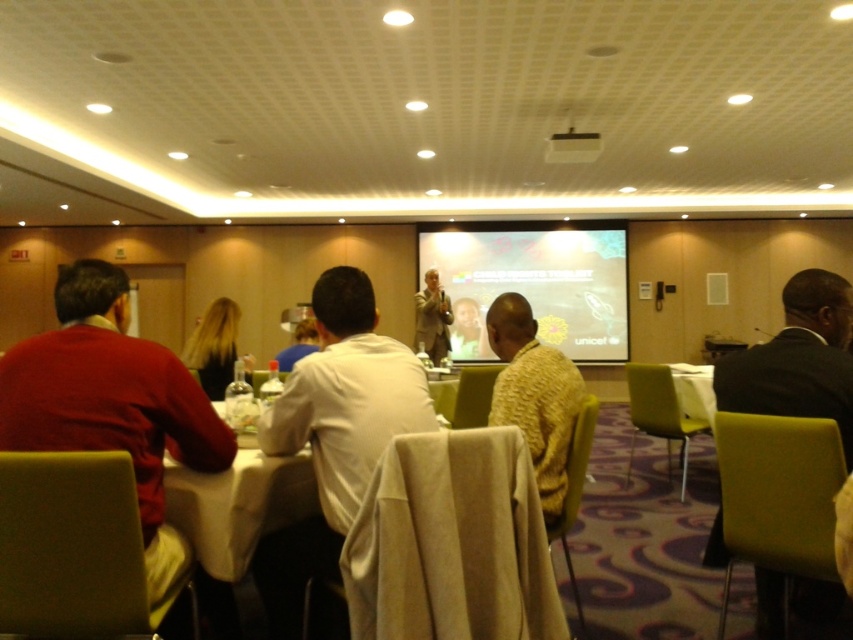
You are standing at the back of the conference room and want to check if you can reach the matte projector screen at center from your current position. The room is 35 feet long. Can you reach it?

The matte projector screen at center is 31.10 feet away from the camera. Since the room is 35 feet long, you are within the room length and can reach it.

You are standing at the entrance of the conference room and want to locate the presenter who is wearing the white matte shirt at center. According to the coordinates provided, in which direction should you look to find the presenter?

The white matte shirt at center is located at coordinates point (335, 433), which is towards the lower right of the image, so you should look towards the lower right direction to find the presenter.

You are standing in the conference room and want to move from point A to point B. Point A is at coordinates point (341, 342) and point B is at coordinates point (596, 141). According to the scene description, which point is closer to the front of the room?

Point (341, 342) is in front of point (596, 141), so point A is closer to the front of the room.